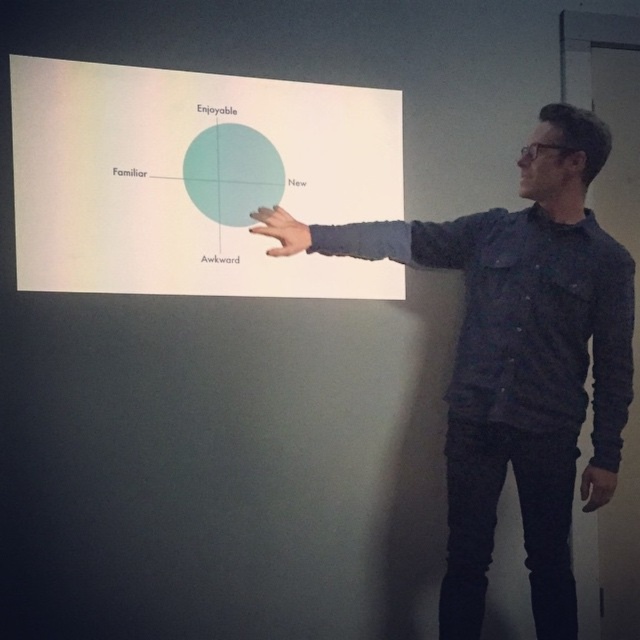
Question: Which object is closer to the camera taking this photo?

Choices:
 (A) dark blue shirt at upper right
 (B) matte black hand at upper right

Answer: (A)

Question: Which of the following is the closest to the observer?

Choices:
 (A) (490, 536)
 (B) (296, 154)

Answer: (A)

Question: Can you confirm if matte teal circle at center is positioned below matte black hand at upper right?

Choices:
 (A) no
 (B) yes

Answer: (A)

Question: From the image, what is the correct spatial relationship of white paper at center in relation to matte black hand at upper center?

Choices:
 (A) left
 (B) right

Answer: (A)

Question: Can you confirm if matte teal circle at center is positioned above matte black hand at upper center?

Choices:
 (A) no
 (B) yes

Answer: (B)

Question: Estimate the real-world distances between objects in this image. Which object is closer to the matte black hand at upper right?

Choices:
 (A) matte black hand at upper center
 (B) white paper at center
 (C) matte teal circle at center

Answer: (A)